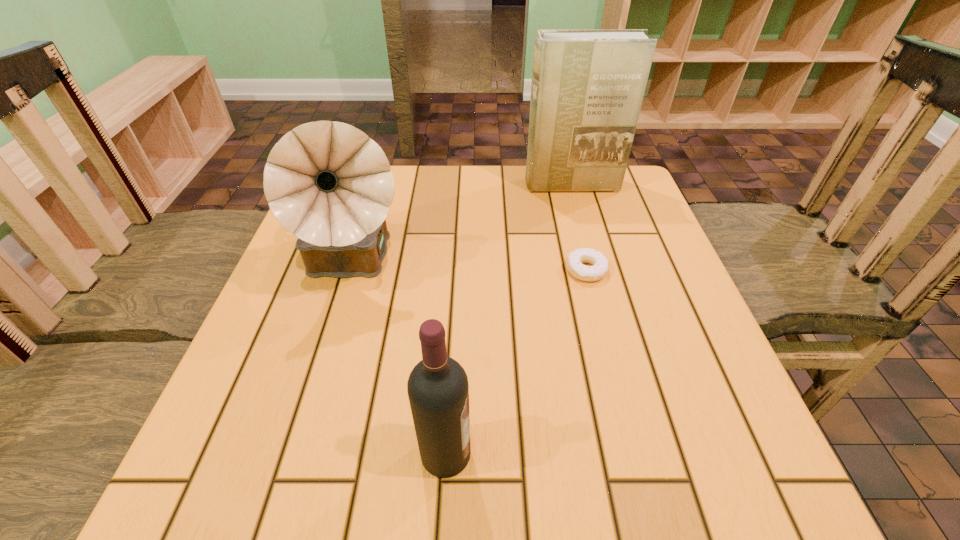
Locate which object is the third closest to the nearest object. Please provide its 2D coordinates. Your answer should be formatted as a tuple, i.e. [(x, y)], where the tuple contains the x and y coordinates of a point satisfying the conditions above.

[(587, 89)]

Select which object is the third closest to the leftmost object. Please provide its 2D coordinates. Your answer should be formatted as a tuple, i.e. [(x, y)], where the tuple contains the x and y coordinates of a point satisfying the conditions above.

[(575, 259)]

At what (x,y) coordinates should I click in order to perform the action: click on free space that satisfies the following two spatial constraints: 1. from the horn of the record player; 2. on the right side of the shortest object. Please return your answer as a coordinate pair (x, y). Looking at the image, I should click on (351, 270).

Find the location of a particular element. This screenshot has width=960, height=540. free space that satisfies the following two spatial constraints: 1. from the horn of the record player; 2. on the right side of the shortest object is located at coordinates (351, 270).

At what (x,y) coordinates should I click in order to perform the action: click on free spot that satisfies the following two spatial constraints: 1. from the horn of the record player; 2. on the right side of the doughnut. Please return your answer as a coordinate pair (x, y). Looking at the image, I should click on (351, 270).

Find the location of a particular element. free region that satisfies the following two spatial constraints: 1. on the cover of the farthest object; 2. on the label of the second shortest object is located at coordinates (643, 454).